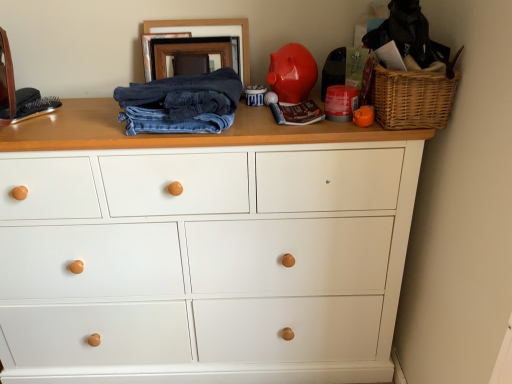
Question: From a real-world perspective, is glossy ceramic piggy bank at upper center physically located above or below white matte chest of drawers at center?

Choices:
 (A) below
 (B) above

Answer: (B)

Question: Is glossy ceramic piggy bank at upper center taller or shorter than white matte chest of drawers at center?

Choices:
 (A) short
 (B) tall

Answer: (A)

Question: Estimate the real-world distances between objects in this image. Which object is farther from the glossy ceramic piggy bank at upper center?

Choices:
 (A) wooden picture frame at upper center
 (B) white matte chest of drawers at center
 (C) woven brown basket at upper right
 (D) dark blue denim jeans at center

Answer: (B)

Question: Estimate the real-world distances between objects in this image. Which object is closer to the dark blue denim jeans at center?

Choices:
 (A) glossy ceramic piggy bank at upper center
 (B) white matte chest of drawers at center
 (C) wooden picture frame at upper center
 (D) woven brown basket at upper right

Answer: (A)